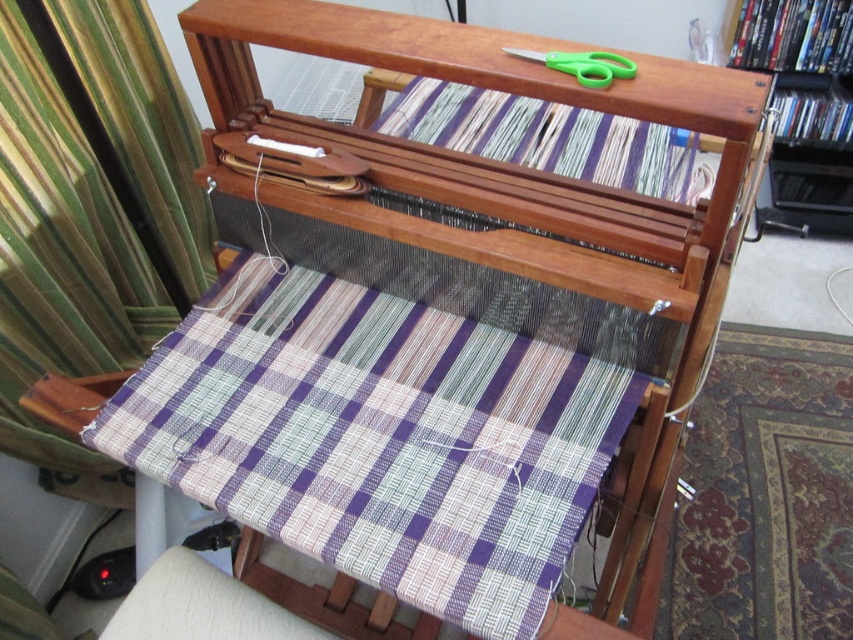
Question: Is green fabric curtain at left wider than green plastic scissors at upper center?

Choices:
 (A) yes
 (B) no

Answer: (A)

Question: Does purple woven fabric at center have a smaller size compared to wooden bookshelf at upper right?

Choices:
 (A) no
 (B) yes

Answer: (A)

Question: Which object is positioned closest to the green plastic scissors at upper center?

Choices:
 (A) purple woven fabric at center
 (B) wooden bookshelf at upper right
 (C) green fabric curtain at left
 (D) plaid fabric at upper center

Answer: (D)

Question: Which object is the closest to the wooden bookshelf at upper right?

Choices:
 (A) plaid fabric at upper center
 (B) green fabric curtain at left
 (C) green plastic scissors at upper center
 (D) purple woven fabric at center

Answer: (A)

Question: Is plaid fabric at upper center smaller than green plastic scissors at upper center?

Choices:
 (A) yes
 (B) no

Answer: (B)

Question: Which is nearer to the purple woven fabric at center?

Choices:
 (A) green plastic scissors at upper center
 (B) plaid fabric at upper center
 (C) wooden bookshelf at upper right

Answer: (B)